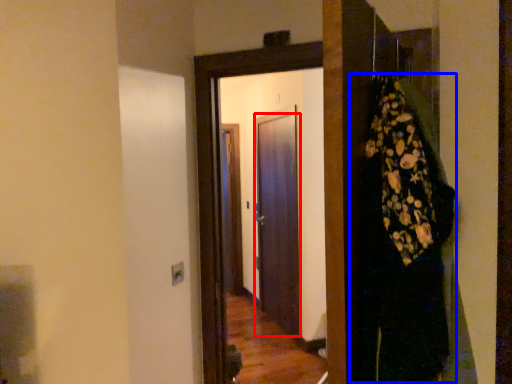
Question: Which object appears farthest to the camera in this image, door (highlighted by a red box) or dress (highlighted by a blue box)?

Choices:
 (A) door
 (B) dress

Answer: (A)